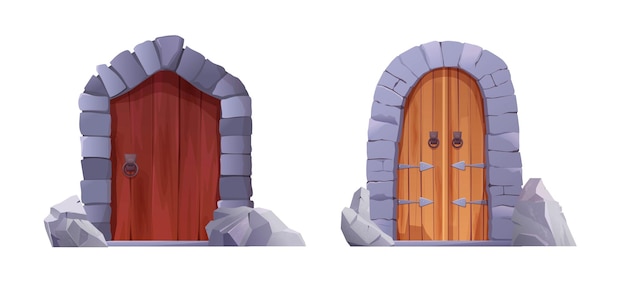
Find the location of a particular element. Image resolution: width=626 pixels, height=294 pixels. door handle is located at coordinates (128, 158).